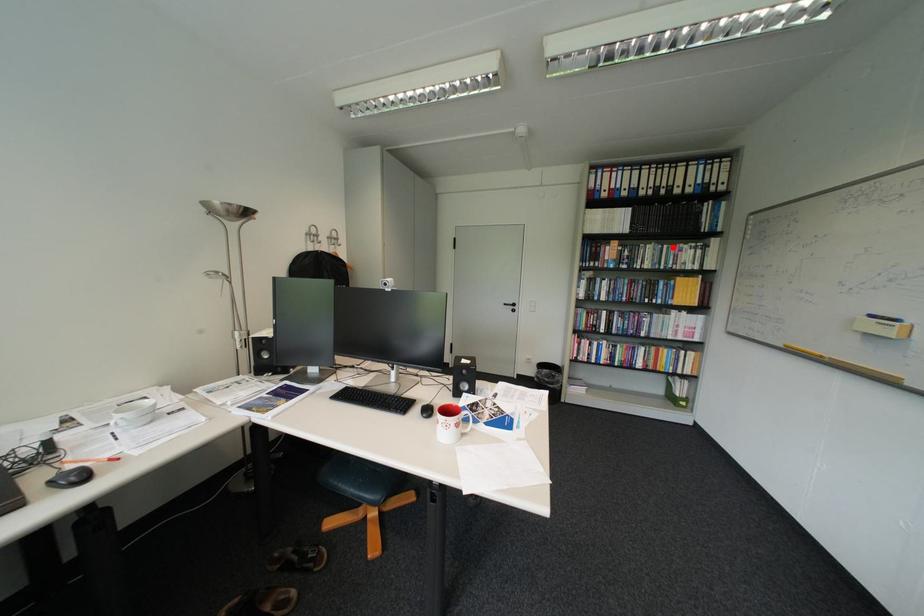
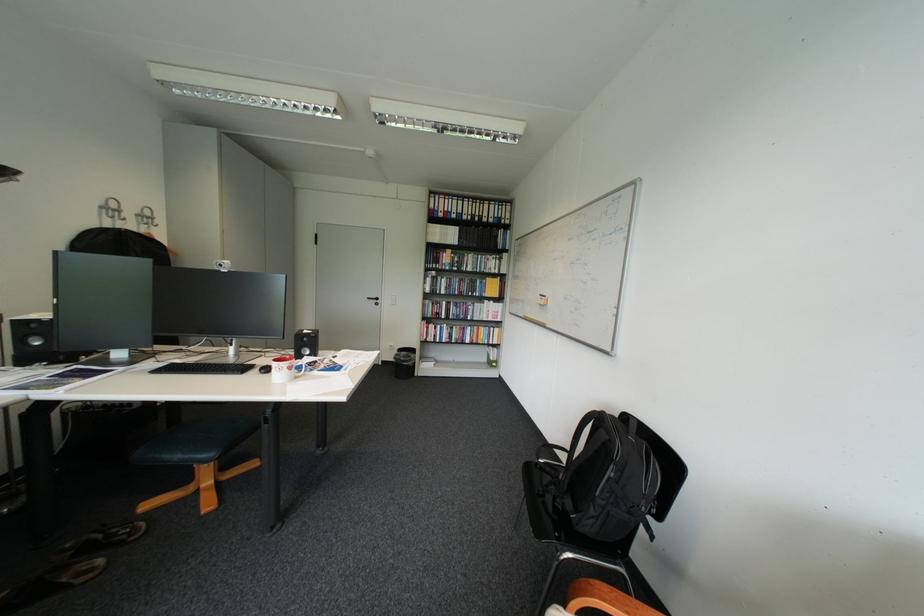
Where in the second image is the point corresponding to the highlighted location from the first image?

(489, 257)